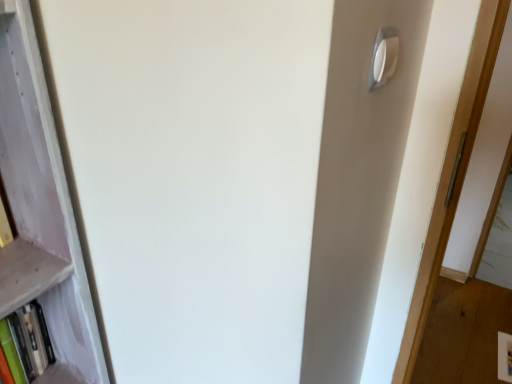
This screenshot has width=512, height=384. What do you see at coordinates (384, 56) in the screenshot?
I see `white plastic light switch at upper right` at bounding box center [384, 56].

You are a GUI agent. You are given a task and a screenshot of the screen. Output one action in this format:
    pyautogui.click(x=<x>, y=<y>)
    Task: Click on the white plastic light switch at upper right
    The image size is (512, 384).
    Given the screenshot: What is the action you would take?
    pyautogui.click(x=384, y=56)

In order to face white plastic light switch at upper right, should I rotate leftwards or rightwards?

You should rotate right by 17.473 degrees.

At what (x,y) coordinates should I click in order to perform the action: click on white plastic light switch at upper right. Please return your answer as a coordinate pair (x, y). Looking at the image, I should click on (384, 56).